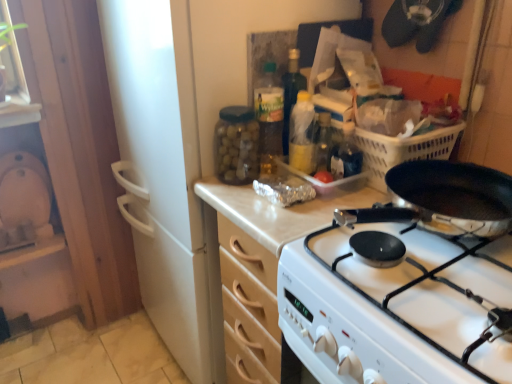
Question: From the image's perspective, does white glossy gas stove at center appear lower than translucent plastic bottle at center, the 2th bottle viewed from the right?

Choices:
 (A) no
 (B) yes

Answer: (B)

Question: Would you say translucent plastic bottle at center, placed as the second bottle when sorted from left to right, is part of white glossy gas stove at center's contents?

Choices:
 (A) no
 (B) yes

Answer: (A)

Question: From a real-world perspective, is white glossy gas stove at center beneath translucent plastic bottle at center, the 2th bottle viewed from the right?

Choices:
 (A) yes
 (B) no

Answer: (A)

Question: Can we say white glossy gas stove at center lies outside translucent plastic bottle at center, the 2th bottle viewed from the right?

Choices:
 (A) yes
 (B) no

Answer: (A)

Question: Does white glossy gas stove at center have a larger size compared to translucent plastic bottle at center, placed as the second bottle when sorted from left to right?

Choices:
 (A) yes
 (B) no

Answer: (A)

Question: Does point (224, 130) appear closer or farther from the camera than point (202, 182)?

Choices:
 (A) closer
 (B) farther

Answer: (A)

Question: Would you say transparent glass jar at upper center, which is the third bottle from right to left, is to the left or to the right of wooden cabinet at center in the picture?

Choices:
 (A) right
 (B) left

Answer: (B)

Question: Is transparent glass jar at upper center, which is the third bottle from right to left, taller or shorter than wooden cabinet at center?

Choices:
 (A) short
 (B) tall

Answer: (A)

Question: From a real-world perspective, is transparent glass jar at upper center, which is the third bottle from right to left, above or below wooden cabinet at center?

Choices:
 (A) below
 (B) above

Answer: (B)

Question: Based on their sizes in the image, would you say clear plastic container at center is bigger or smaller than translucent plastic bottle at center, acting as the third bottle starting from the left?

Choices:
 (A) small
 (B) big

Answer: (B)

Question: Is clear plastic container at center situated inside translucent plastic bottle at center, acting as the third bottle starting from the left, or outside?

Choices:
 (A) outside
 (B) inside

Answer: (A)

Question: In the image, is clear plastic container at center positioned in front of or behind translucent plastic bottle at center, acting as the third bottle starting from the left?

Choices:
 (A) behind
 (B) front

Answer: (A)

Question: Is point (337, 180) closer or farther from the camera than point (290, 129)?

Choices:
 (A) closer
 (B) farther

Answer: (A)

Question: Is point (323, 263) positioned closer to the camera than point (332, 188)?

Choices:
 (A) closer
 (B) farther

Answer: (A)

Question: Is white glossy gas stove at center situated inside clear plastic container at center or outside?

Choices:
 (A) outside
 (B) inside

Answer: (A)